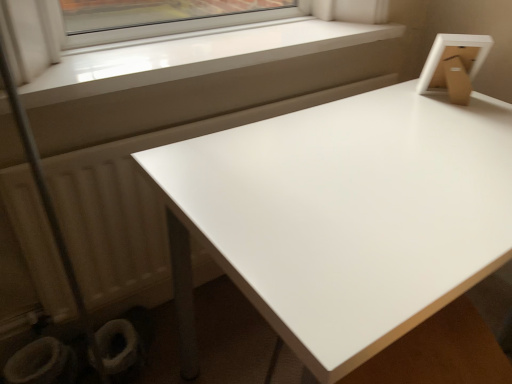
Question: Visually, is white fabric toilet bowl at lower left, the 1th toilet bowl positioned from the right, positioned to the left or to the right of white glossy table at upper right?

Choices:
 (A) left
 (B) right

Answer: (A)

Question: In terms of height, does white fabric toilet bowl at lower left, which appears as the 2th toilet bowl when viewed from the left, look taller or shorter compared to white glossy table at upper right?

Choices:
 (A) tall
 (B) short

Answer: (B)

Question: Estimate the real-world distances between objects in this image. Which object is closer to the white matte radiator at lower left?

Choices:
 (A) white glossy toilet bowl at lower left, the 1th toilet bowl viewed from the left
 (B) white smooth window sill at upper left
 (C) white fabric toilet bowl at lower left, which appears as the 2th toilet bowl when viewed from the left
 (D) white glossy table at upper right

Answer: (B)

Question: Which of these objects is positioned farthest from the white glossy table at upper right?

Choices:
 (A) white matte radiator at lower left
 (B) white fabric toilet bowl at lower left, the 1th toilet bowl positioned from the right
 (C) white smooth window sill at upper left
 (D) white glossy toilet bowl at lower left, which appears as the 2th toilet bowl when viewed from the right

Answer: (D)